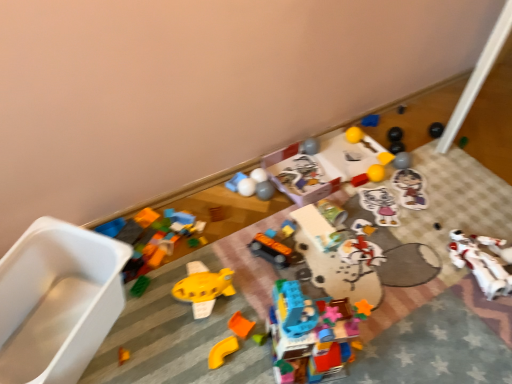
Where is `free space between matte plastic sticker at center, which is the second toy in right-to-left order, and matte white plush cat at center, the thirteenth toy viewed from the left`? free space between matte plastic sticker at center, which is the second toy in right-to-left order, and matte white plush cat at center, the thirteenth toy viewed from the left is located at coordinates (395, 201).